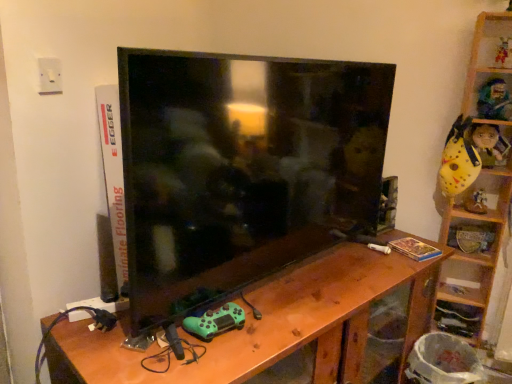
What are the coordinates of `wooden at right, acting as the 1th shelf starting from the bottom` in the screenshot? It's located at (473, 236).

Measure the distance between wooden mask at upper right, the third toy viewed from the front, and camera.

A distance of 1.67 meters exists between wooden mask at upper right, the third toy viewed from the front, and camera.

Identify the location of wooden mask at upper right, which appears as the fifth toy when viewed from the left. (494, 100).

Identify the location of matte yellow plush toy at upper right, the 4th toy viewed from the front. (488, 144).

What do you see at coordinates (488, 144) in the screenshot?
I see `matte yellow plush toy at upper right, which appears as the second toy when viewed from the right` at bounding box center [488, 144].

Where is `wooden at right, the 2th shelf positioned from the top`? Image resolution: width=512 pixels, height=384 pixels. wooden at right, the 2th shelf positioned from the top is located at coordinates (473, 236).

Can you confirm if matte yellow plush toy at upper right, the 4th toy positioned from the left, is positioned to the right of green matte controller at lower center, which ranks as the 1th toy in front-to-back order?

Correct, you'll find matte yellow plush toy at upper right, the 4th toy positioned from the left, to the right of green matte controller at lower center, which ranks as the 1th toy in front-to-back order.

Is matte yellow plush toy at upper right, which is the 3th toy from bottom to top, shorter than green matte controller at lower center, the fifth toy when ordered from back to front?

No, matte yellow plush toy at upper right, which is the 3th toy from bottom to top, is not shorter than green matte controller at lower center, the fifth toy when ordered from back to front.

Is point (488, 129) closer or farther from the camera than point (187, 326)?

Point (488, 129) appears to be farther away from the viewer than point (187, 326).

From the image's perspective, count 2nd toys downward from the matte yellow plush toy at upper right, the 2th toy when ordered from back to front, and point to it. Please provide its 2D coordinates.

[(215, 321)]

Measure the distance between green matte controller at lower center, arranged as the 5th toy when viewed from the right, and white plastic electric outlet at upper left.

28.00 inches.

Are green matte controller at lower center, which ranks as the 1th toy in front-to-back order, and white plastic electric outlet at upper left making contact?

No, green matte controller at lower center, which ranks as the 1th toy in front-to-back order, is not beside white plastic electric outlet at upper left.

Does green matte controller at lower center, the fifth toy when ordered from top to bottom, have a larger size compared to white plastic electric outlet at upper left?

Yes.

Considering the relative sizes of matte yellow plush toy at upper right, the 4th toy viewed from the front, and yellow matte plush toy at upper right, placed as the 1th toy when sorted from back to front, in the image provided, is matte yellow plush toy at upper right, the 4th toy viewed from the front, shorter than yellow matte plush toy at upper right, placed as the 1th toy when sorted from back to front,?

In fact, matte yellow plush toy at upper right, the 4th toy viewed from the front, may be taller than yellow matte plush toy at upper right, placed as the 1th toy when sorted from back to front.

Would you consider matte yellow plush toy at upper right, the 4th toy positioned from the left, to be distant from yellow matte plush toy at upper right, placed as the 2th toy when sorted from bottom to top?

No, matte yellow plush toy at upper right, the 4th toy positioned from the left, is in close proximity to yellow matte plush toy at upper right, placed as the 2th toy when sorted from bottom to top.

Does point (482, 189) lie behind point (42, 71)?

That is True.

Is yellow matte plush toy at upper right, placed as the 1th toy when sorted from back to front, inside the boundaries of white plastic electric outlet at upper left, or outside?

yellow matte plush toy at upper right, placed as the 1th toy when sorted from back to front, is not enclosed by white plastic electric outlet at upper left.

Is yellow matte plush toy at upper right, acting as the second toy starting from the left, bigger than white plastic electric outlet at upper left?

Yes, yellow matte plush toy at upper right, acting as the second toy starting from the left, is bigger than white plastic electric outlet at upper left.

Which object is closer to the camera, yellow matte plush toy at upper right, placed as the 1th toy when sorted from back to front, or white plastic electric outlet at upper left?

white plastic electric outlet at upper left is more forward.

Between wooden at right, acting as the 1th shelf starting from the bottom, and green matte controller at lower center, the fifth toy when ordered from top to bottom, which one has larger width?

green matte controller at lower center, the fifth toy when ordered from top to bottom, is wider.

Between wooden at right, acting as the 1th shelf starting from the bottom, and green matte controller at lower center, the fifth toy when ordered from back to front, which one has smaller size?

With smaller size is green matte controller at lower center, the fifth toy when ordered from back to front.

From a real-world perspective, is wooden at right, the 2th shelf positioned from the top, physically below green matte controller at lower center, the fifth toy when ordered from top to bottom?

Yes, from a real-world perspective, wooden at right, the 2th shelf positioned from the top, is under green matte controller at lower center, the fifth toy when ordered from top to bottom.

From the image's perspective, is wooden at right, the 2th shelf positioned from the top, located beneath green matte controller at lower center, arranged as the 5th toy when viewed from the right?

No, from the image's perspective, wooden at right, the 2th shelf positioned from the top, is not below green matte controller at lower center, arranged as the 5th toy when viewed from the right.

Is white plastic electric outlet at upper left facing towards wooden carved mask at upper right, which ranks as the 5th toy in bottom-to-top order?

No, white plastic electric outlet at upper left does not turn towards wooden carved mask at upper right, which ranks as the 5th toy in bottom-to-top order.

Is white plastic electric outlet at upper left thinner than wooden carved mask at upper right, which appears as the first toy when viewed from the top?

Yes, white plastic electric outlet at upper left is thinner than wooden carved mask at upper right, which appears as the first toy when viewed from the top.

Is white plastic electric outlet at upper left taller than wooden carved mask at upper right, which ranks as the 5th toy in bottom-to-top order?

No, white plastic electric outlet at upper left is not taller than wooden carved mask at upper right, which ranks as the 5th toy in bottom-to-top order.

Which object is closer to the camera, white plastic electric outlet at upper left or wooden carved mask at upper right, which ranks as the 5th toy in bottom-to-top order?

white plastic electric outlet at upper left.

Is point (508, 42) positioned before point (467, 208)?

Yes.

In the scene shown: Is wooden carved mask at upper right, acting as the 4th toy starting from the back, positioned in front of yellow matte plush toy at upper right, placed as the 1th toy when sorted from back to front?

That is True.

Considering the sizes of objects wooden carved mask at upper right, placed as the 3th toy when sorted from right to left, and yellow matte plush toy at upper right, arranged as the fourth toy when viewed from the top, in the image provided, who is bigger, wooden carved mask at upper right, placed as the 3th toy when sorted from right to left, or yellow matte plush toy at upper right, arranged as the fourth toy when viewed from the top,?

wooden carved mask at upper right, placed as the 3th toy when sorted from right to left, is bigger.

Does wooden carved mask at upper right, which appears as the first toy when viewed from the top, have a greater height compared to yellow matte plush toy at upper right, placed as the 1th toy when sorted from back to front?

Indeed, wooden carved mask at upper right, which appears as the first toy when viewed from the top, has a greater height compared to yellow matte plush toy at upper right, placed as the 1th toy when sorted from back to front.

At what (x,y) coordinates should I click in order to perform the action: click on the 3rd toy to the right of the green matte controller at lower center, the fifth toy when ordered from top to bottom, starting your count from the anchor. Please return your answer as a coordinate pair (x, y). This screenshot has width=512, height=384. Looking at the image, I should click on (488, 144).

Locate an element on the screen. The height and width of the screenshot is (384, 512). the 3rd toy below when counting from the white plastic electric outlet at upper left (from the image's perspective) is located at coordinates (215, 321).

Based on their spatial positions, is green matte controller at lower center, which ranks as the 1th toy in front-to-back order, or wooden table at center closer to wooden at right, the 2th shelf positioned from the top?

Based on the image, wooden table at center appears to be nearer to wooden at right, the 2th shelf positioned from the top.

From the image, which object appears to be nearer to wooden table at center, green matte controller at lower center, which is counted as the first toy, starting from the bottom, or yellow matte plush toy at upper right, placed as the 2th toy when sorted from bottom to top?

Based on the image, green matte controller at lower center, which is counted as the first toy, starting from the bottom, appears to be nearer to wooden table at center.

Based on their spatial positions, is matte black tv at center or wooden at right, which is the second shelf from bottom to top, closer to wooden mask at upper right, the third toy viewed from the front?

Based on the image, wooden at right, which is the second shelf from bottom to top, appears to be nearer to wooden mask at upper right, the third toy viewed from the front.

Looking at the image, which one is located closer to matte yellow plush toy at upper right, marked as the third toy in a top-to-bottom arrangement, green matte controller at lower center, the fifth toy when ordered from back to front, or wooden at right, the 2th shelf positioned from the top?

The object closer to matte yellow plush toy at upper right, marked as the third toy in a top-to-bottom arrangement, is wooden at right, the 2th shelf positioned from the top.

Considering their positions, is yellow matte plush toy at upper right, arranged as the fourth toy when viewed from the top, positioned closer to matte yellow plush toy at upper right, which is the 3th toy from bottom to top, than wooden at right, which is the second shelf from bottom to top?

wooden at right, which is the second shelf from bottom to top, is closer to matte yellow plush toy at upper right, which is the 3th toy from bottom to top.

When comparing their distances from matte black tv at center, does wooden table at center or yellow matte plush toy at upper right, arranged as the fourth toy when viewed from the top, seem closer?

The object closer to matte black tv at center is wooden table at center.

Estimate the real-world distances between objects in this image. Which object is closer to wooden mask at upper right, the third toy viewed from the front, wooden carved mask at upper right, which appears as the first toy when viewed from the top, or wooden at right, which is the second shelf from bottom to top?

Based on the image, wooden carved mask at upper right, which appears as the first toy when viewed from the top, appears to be nearer to wooden mask at upper right, the third toy viewed from the front.

Considering their positions, is wooden mask at upper right, which appears as the fifth toy when viewed from the left, positioned further to wooden table at center than wooden at right, the 2th shelf positioned from the top?

wooden mask at upper right, which appears as the fifth toy when viewed from the left, lies further to wooden table at center than the other object.

The width and height of the screenshot is (512, 384). What are the coordinates of `shelf located between wooden table at center and yellow matte plush toy at upper right, the 5th toy in the front-to-back sequence, in the depth direction` in the screenshot? It's located at click(475, 252).

Locate an element on the screen. The height and width of the screenshot is (384, 512). furniture between white plastic electric outlet at upper left and matte yellow plush toy at upper right, the 2th toy when ordered from back to front, in the horizontal direction is located at coordinates (272, 324).

Identify the location of shelf between wooden mask at upper right, which appears as the fourth toy when ordered from the bottom, and wooden at right, acting as the 1th shelf starting from the bottom, vertically. (475, 252).

I want to click on furniture situated between green matte controller at lower center, arranged as the 5th toy when viewed from the right, and matte yellow plush toy at upper right, which appears as the second toy when viewed from the right, from left to right, so click(272, 324).